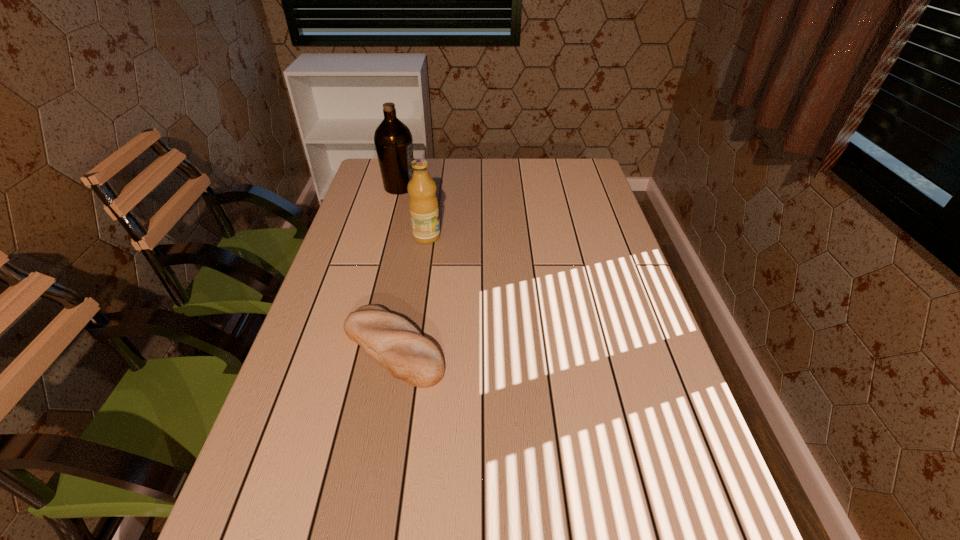
The width and height of the screenshot is (960, 540). I want to click on the farther olive oil, so click(393, 141).

The image size is (960, 540). In order to click on the farthest object in this screenshot , I will do `click(393, 141)`.

Identify the location of the shorter olive oil. (423, 204).

The image size is (960, 540). I want to click on the second nearest object, so click(423, 204).

Where is `the shortest object`? Image resolution: width=960 pixels, height=540 pixels. the shortest object is located at coordinates (392, 341).

You are a GUI agent. You are given a task and a screenshot of the screen. Output one action in this format:
    pyautogui.click(x=<x>, y=<y>)
    Task: Click on the nearest object
    
    Given the screenshot: What is the action you would take?
    pyautogui.click(x=392, y=341)

Identify the location of vacant region located on the label of the taller olive oil. The width and height of the screenshot is (960, 540). (469, 187).

This screenshot has height=540, width=960. What are the coordinates of `free point located on the label of the nearer olive oil` in the screenshot? It's located at (541, 237).

Image resolution: width=960 pixels, height=540 pixels. What are the coordinates of `vacant space situated on the back of the shortest object` in the screenshot? It's located at (415, 232).

Locate an element on the screen. object that is positioned at the far edge is located at coordinates (393, 141).